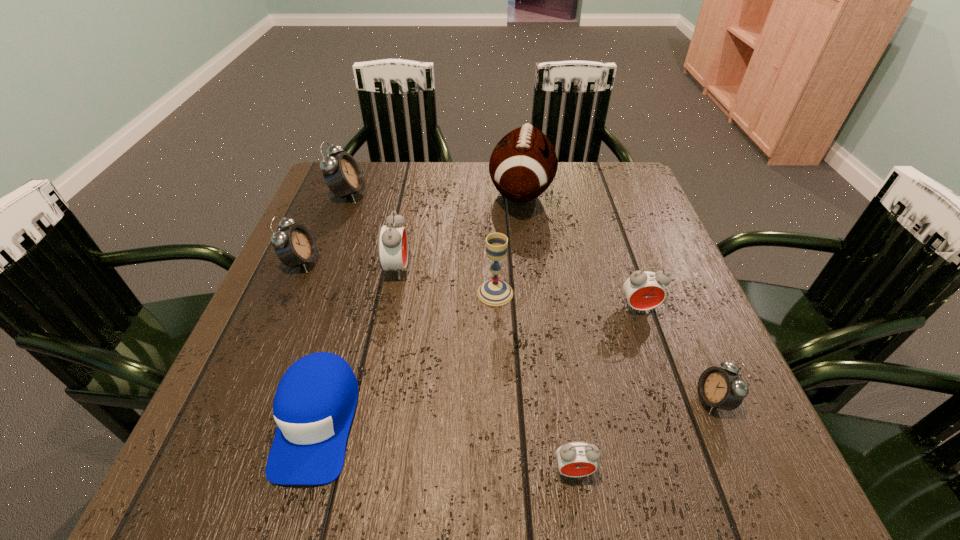
This screenshot has width=960, height=540. I want to click on vacant region at the far edge, so click(x=382, y=185).

In the image, there is a desktop. Where is `free space at the near edge`? Image resolution: width=960 pixels, height=540 pixels. free space at the near edge is located at coordinates (482, 493).

Locate an element on the screen. blank space at the left edge is located at coordinates (274, 298).

Where is `vacant area at the right edge`? vacant area at the right edge is located at coordinates (623, 302).

In the image, there is a desktop. Find the location of `vacant region at the far left corner`. vacant region at the far left corner is located at coordinates (367, 183).

At what (x,y) coordinates should I click in order to perform the action: click on vacant space at the near left corner of the desktop. Please return your answer as a coordinate pair (x, y). The image size is (960, 540). Looking at the image, I should click on (218, 488).

Identify the location of free space at the far right corner. (615, 175).

This screenshot has width=960, height=540. In order to click on unoccupied area between the tallest object and the smallest white alarm clock in this screenshot , I will do `click(617, 296)`.

At what (x,y) coordinates should I click in order to perform the action: click on free point between the second biggest white alarm clock and the blue baseball cap. Please return your answer as a coordinate pair (x, y). Looking at the image, I should click on (309, 341).

The image size is (960, 540). What are the coordinates of `vacant space that's between the tallest object and the smallest red alarm clock` in the screenshot? It's located at (547, 332).